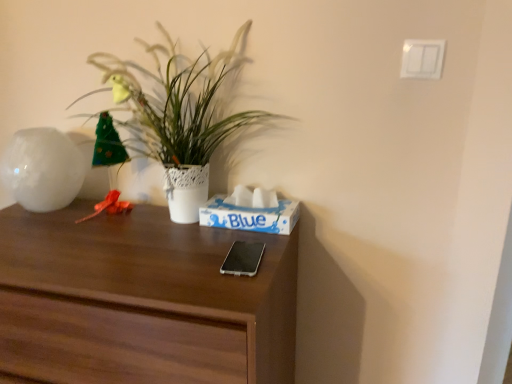
What do you see at coordinates (141, 300) in the screenshot? I see `dark wood desk at center` at bounding box center [141, 300].

What is the approximate height of silver metallic phone at center?

silver metallic phone at center is 1.69 centimeters in height.

Describe the element at coordinates (250, 216) in the screenshot. I see `blue paper tissue box at center` at that location.

Identify the location of dark wood desk at center. (141, 300).

Consider the image. Is blue paper tissue box at center next to white lace pot at upper left?

blue paper tissue box at center is not next to white lace pot at upper left, and they're not touching.

Is white lace pot at upper left surrounded by blue paper tissue box at center?

No, white lace pot at upper left is not inside blue paper tissue box at center.

Is blue paper tissue box at center further to camera compared to white lace pot at upper left?

Yes, blue paper tissue box at center is further from the viewer.

Which of these two, blue paper tissue box at center or white lace pot at upper left, is bigger?

white lace pot at upper left is bigger.

Does silver metallic phone at center have a smaller size compared to dark wood desk at center?

Yes, silver metallic phone at center is smaller than dark wood desk at center.

Between silver metallic phone at center and dark wood desk at center, which one has more height?

dark wood desk at center is taller.

Considering the relative positions of silver metallic phone at center and dark wood desk at center in the image provided, is silver metallic phone at center to the left or to the right of dark wood desk at center?

Clearly, silver metallic phone at center is on the right of dark wood desk at center in the image.

Does white lace pot at upper left contain silver metallic phone at center?

That's incorrect, silver metallic phone at center is not inside white lace pot at upper left.

Between white lace pot at upper left and silver metallic phone at center, which one has smaller width?

white lace pot at upper left.

Is white lace pot at upper left positioned far away from silver metallic phone at center?

white lace pot at upper left is near silver metallic phone at center, not far away.

I want to click on houseplant on the left side of silver metallic phone at center, so click(x=181, y=114).

Identify the location of mobile phone on the left of blue paper tissue box at center. (243, 258).

Is silver metallic phone at center in front of or behind blue paper tissue box at center in the image?

Clearly, silver metallic phone at center is in front of blue paper tissue box at center.

Based on the photo, is silver metallic phone at center oriented away from blue paper tissue box at center?

Yes.

Which object is thinner, silver metallic phone at center or blue paper tissue box at center?

blue paper tissue box at center is thinner.

Looking at their sizes, would you say dark wood desk at center is wider or thinner than blue paper tissue box at center?

Clearly, dark wood desk at center has more width compared to blue paper tissue box at center.

Locate an element on the screen. The width and height of the screenshot is (512, 384). desk on the left side of blue paper tissue box at center is located at coordinates (141, 300).

Measure the distance between dark wood desk at center and blue paper tissue box at center.

dark wood desk at center and blue paper tissue box at center are 10.04 inches apart.

Is the depth of dark wood desk at center less than that of blue paper tissue box at center?

Yes, dark wood desk at center is in front of blue paper tissue box at center.

Considering the points (236, 34) and (234, 223), which point is behind, point (236, 34) or point (234, 223)?

The point (236, 34) is behind.

Is the depth of white lace pot at upper left greater than that of blue paper tissue box at center?

No, white lace pot at upper left is closer to the viewer.

Is white lace pot at upper left with blue paper tissue box at center?

white lace pot at upper left is not next to blue paper tissue box at center, and they're not touching.

Can you confirm if white lace pot at upper left is thinner than blue paper tissue box at center?

Incorrect, the width of white lace pot at upper left is not less than that of blue paper tissue box at center.

Is white glossy vase at left thinner than dark wood desk at center?

Correct, the width of white glossy vase at left is less than that of dark wood desk at center.

Image resolution: width=512 pixels, height=384 pixels. Identify the location of desk that appears on the right of white glossy vase at left. (141, 300).

How far apart are white glossy vase at left and dark wood desk at center?

white glossy vase at left and dark wood desk at center are 12.44 inches apart from each other.

Considering the positions of point (10, 169) and point (30, 311), is point (10, 169) closer or farther from the camera than point (30, 311)?

Point (10, 169) appears to be farther away from the viewer than point (30, 311).

Locate an element on the screen. shoe box that is below the white lace pot at upper left (from the image's perspective) is located at coordinates (250, 216).

Locate an element on the screen. The image size is (512, 384). desk located in front of the silver metallic phone at center is located at coordinates (141, 300).

Looking at the image, which one is located further to dark wood desk at center, white glossy vase at left or blue paper tissue box at center?

white glossy vase at left is positioned further to the anchor dark wood desk at center.

Which object lies further to the anchor point blue paper tissue box at center, white lace pot at upper left or white glossy vase at left?

white glossy vase at left is positioned further to the anchor blue paper tissue box at center.

Looking at this image, considering their positions, is dark wood desk at center positioned closer to white lace pot at upper left than white glossy vase at left?

Based on the image, dark wood desk at center appears to be nearer to white lace pot at upper left.

When comparing their distances from white lace pot at upper left, does white glossy vase at left or dark wood desk at center seem further?

white glossy vase at left is further to white lace pot at upper left.

When comparing their distances from blue paper tissue box at center, does silver metallic phone at center or white glossy vase at left seem further?

The object further to blue paper tissue box at center is white glossy vase at left.

Based on their spatial positions, is silver metallic phone at center or white lace pot at upper left further from dark wood desk at center?

white lace pot at upper left is further to dark wood desk at center.

When comparing their distances from silver metallic phone at center, does white lace pot at upper left or white glossy vase at left seem closer?

white lace pot at upper left is positioned closer to the anchor silver metallic phone at center.

Estimate the real-world distances between objects in this image. Which object is further from white lace pot at upper left, silver metallic phone at center or white glossy vase at left?

silver metallic phone at center lies further to white lace pot at upper left than the other object.

This screenshot has width=512, height=384. I want to click on mobile phone between white glossy vase at left and blue paper tissue box at center in the horizontal direction, so click(243, 258).

Identify the location of shoe box between white lace pot at upper left and dark wood desk at center from top to bottom. (250, 216).

Where is `vase between white lace pot at upper left and dark wood desk at center from top to bottom`? The image size is (512, 384). vase between white lace pot at upper left and dark wood desk at center from top to bottom is located at coordinates (42, 169).

Where is `mobile phone between white lace pot at upper left and dark wood desk at center from top to bottom`? The image size is (512, 384). mobile phone between white lace pot at upper left and dark wood desk at center from top to bottom is located at coordinates (243, 258).